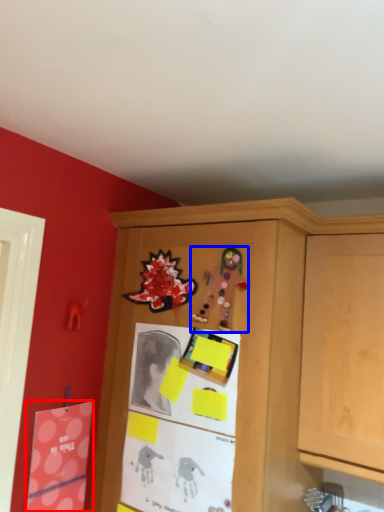
Question: Which object is closer to the camera taking this photo, postcard (highlighted by a red box) or art (highlighted by a blue box)?

Choices:
 (A) postcard
 (B) art

Answer: (B)